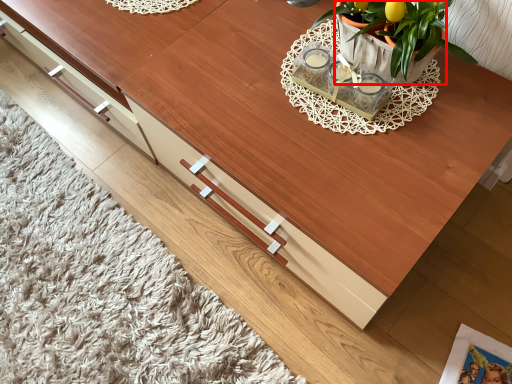
Question: From the image, what is the correct spatial relationship of flowerpot (annotated by the red box) in relation to magazine?

Choices:
 (A) left
 (B) right

Answer: (A)